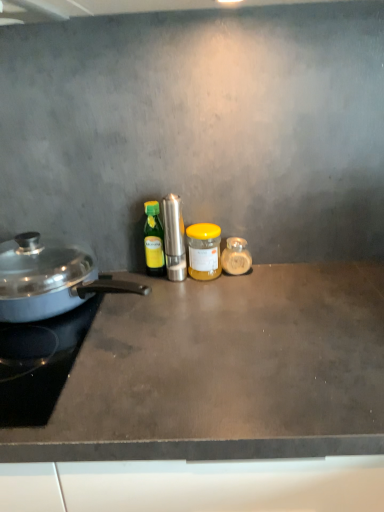
The width and height of the screenshot is (384, 512). I want to click on vacant space that is in between shiny silver pan at left, acting as the fifth kitchen appliance starting from the right, and yellow matte jar at center, the fourth kitchen appliance viewed from the left, so click(x=186, y=302).